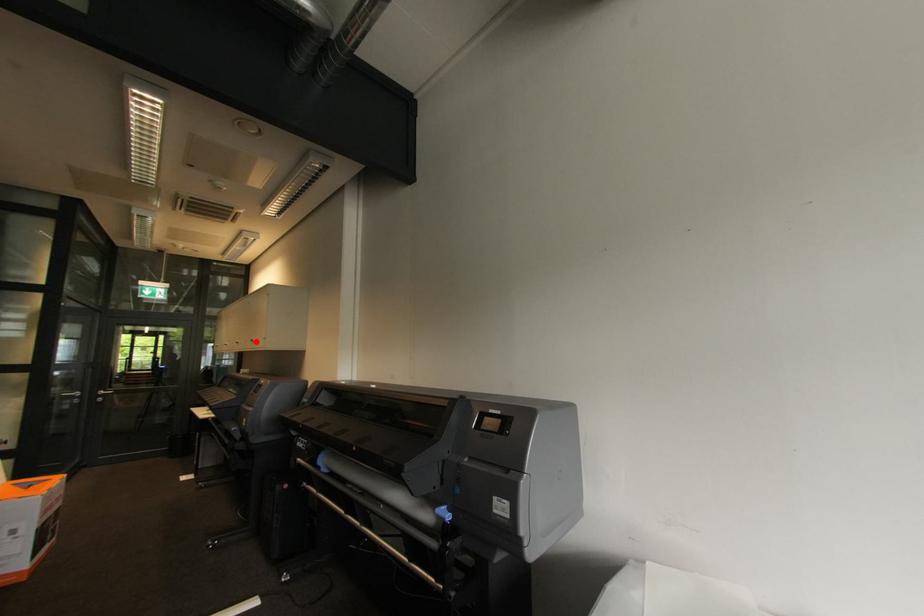
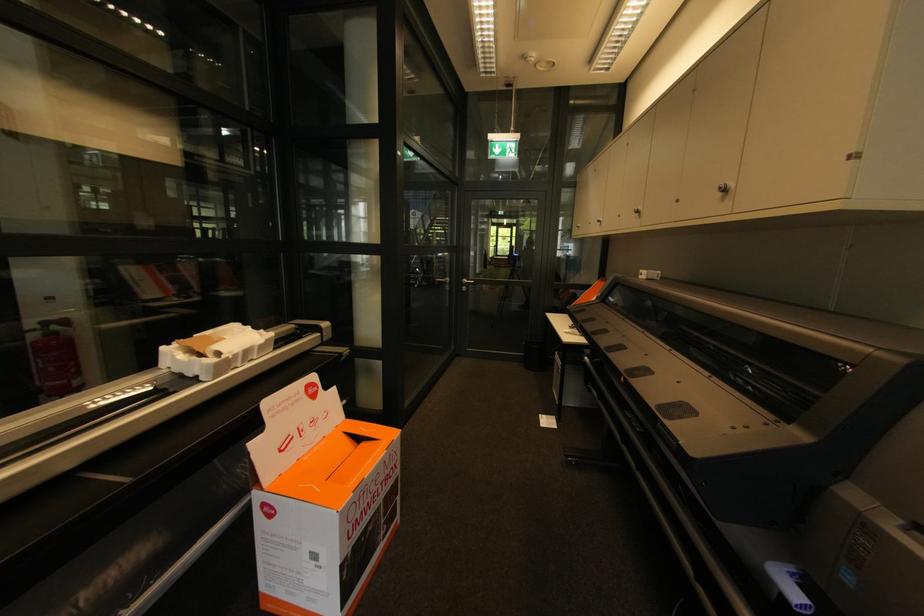
Locate, in the second image, the point that corresponds to the highlighted location in the first image.

(727, 191)